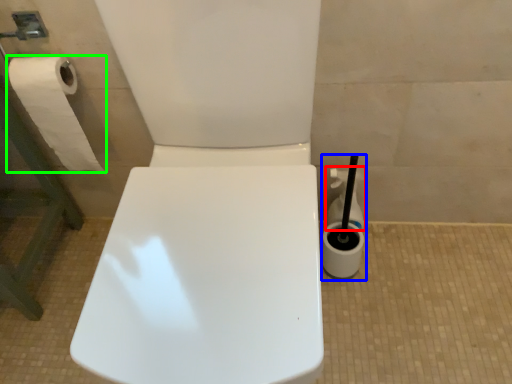
Question: Which object is the closest to the cleaning product (highlighted by a red box)? Choose among these: cleaning product (highlighted by a blue box) or toilet paper (highlighted by a green box).

Choices:
 (A) cleaning product
 (B) toilet paper

Answer: (A)